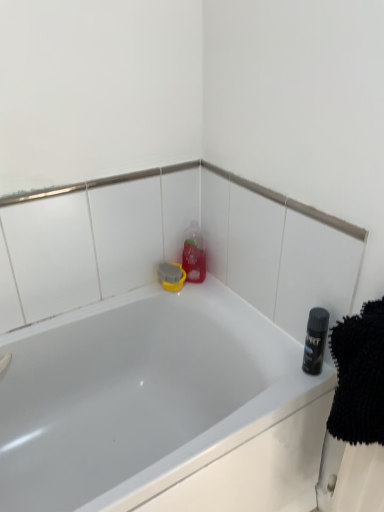
Question: Can you confirm if white glossy bathtub at center is wider than shiny black can at right?

Choices:
 (A) no
 (B) yes

Answer: (B)

Question: Does white glossy bathtub at center have a lesser width compared to shiny black can at right?

Choices:
 (A) yes
 (B) no

Answer: (B)

Question: Is white glossy bathtub at center smaller than shiny black can at right?

Choices:
 (A) no
 (B) yes

Answer: (A)

Question: Is white glossy bathtub at center positioned in front of shiny black can at right?

Choices:
 (A) yes
 (B) no

Answer: (A)

Question: Can you confirm if white glossy bathtub at center is bigger than shiny black can at right?

Choices:
 (A) no
 (B) yes

Answer: (B)

Question: Can you confirm if white glossy bathtub at center is positioned to the right of shiny black can at right?

Choices:
 (A) yes
 (B) no

Answer: (B)

Question: Is shiny black can at right placed right next to white glossy bathtub at center?

Choices:
 (A) yes
 (B) no

Answer: (B)

Question: Does shiny black can at right have a larger size compared to white glossy bathtub at center?

Choices:
 (A) no
 (B) yes

Answer: (A)

Question: Is shiny black can at right smaller than white glossy bathtub at center?

Choices:
 (A) yes
 (B) no

Answer: (A)

Question: From a real-world perspective, is shiny black can at right positioned over white glossy bathtub at center based on gravity?

Choices:
 (A) yes
 (B) no

Answer: (A)

Question: Is shiny black can at right wider than white glossy bathtub at center?

Choices:
 (A) yes
 (B) no

Answer: (B)

Question: Is shiny black can at right outside white glossy bathtub at center?

Choices:
 (A) yes
 (B) no

Answer: (A)

Question: Is shiny black can at right to the right of translucent plastic bottle at upper center from the viewer's perspective?

Choices:
 (A) yes
 (B) no

Answer: (A)